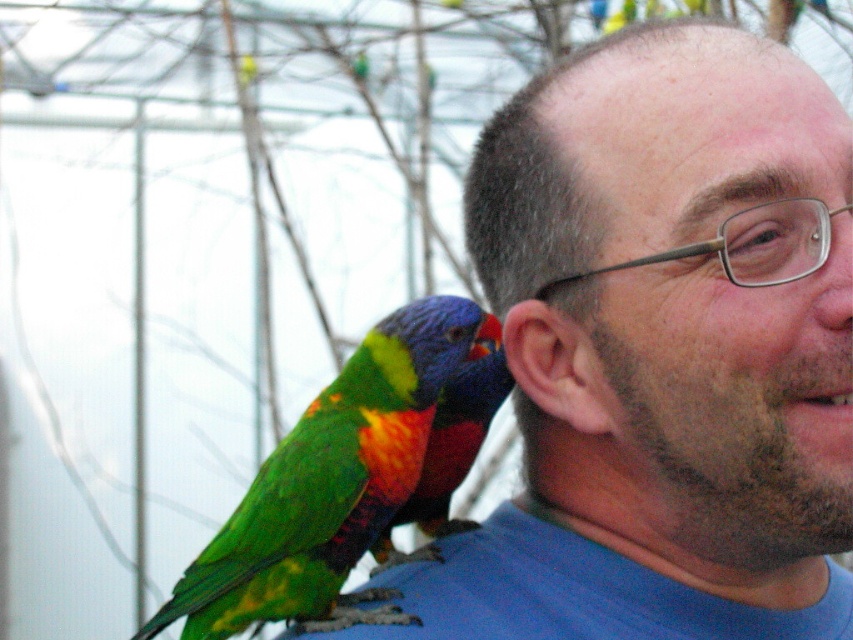
Is multicolored feathered parrot at upper left positioned in front of smooth skin head at center?

No, multicolored feathered parrot at upper left is further to the viewer.

Between multicolored feathered parrot at upper left and smooth skin head at center, which one is positioned higher?

smooth skin head at center

Is point (401, 452) behind point (518, 122)?

Yes, it is behind point (518, 122).

The height and width of the screenshot is (640, 853). In order to click on multicolored feathered parrot at upper left in this screenshot , I will do `click(332, 483)`.